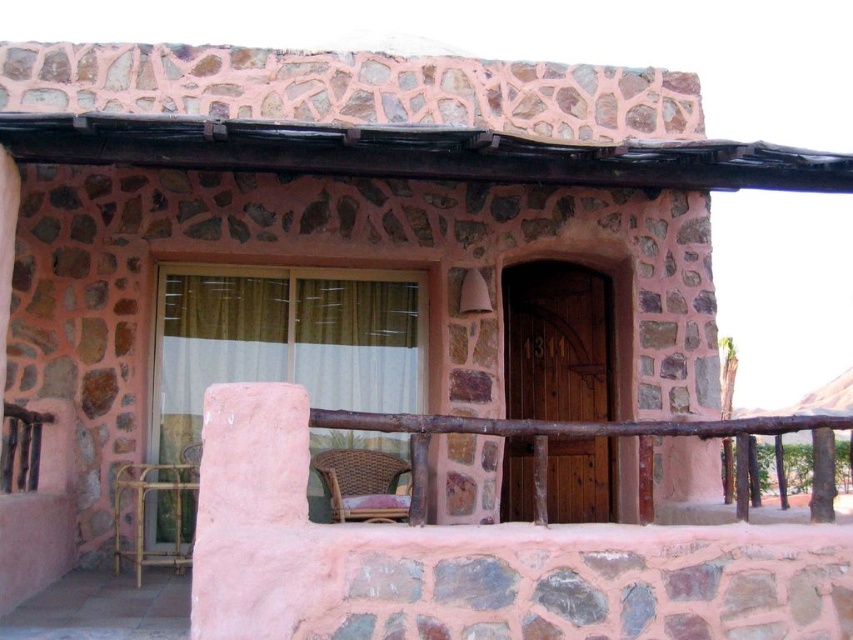
You are a delivery person with a package that measures 1.5 meters in length. You need to navigate between the rattan chair at lower center and the gold bamboo balustrade at lower left to reach the front door. Can your package fit through the space between them?

The distance between the rattan chair at lower center and the gold bamboo balustrade at lower left is 1.44 meters. Since the package is 1.5 meters long, it is slightly too wide to fit through the space. You will need to find an alternative route or reposition the objects to create more space.

You are sitting on the gold bamboo balustrade at lower left and want to move to the rattan chair at lower center. Which direction should you move to reach it?

You should move to the right to reach the rattan chair at lower center since it is positioned on the right side of the gold bamboo balustrade at lower left.

You are trying to move a rectangular table that is 1.2 meters wide through the space between the rattan chair at lower center and the gold bamboo balustrade at lower left. Based on the scene description, can the table fit through that space?

The rattan chair at lower center might be wider than gold bamboo balustrade at lower left, so the space between them may not be wide enough for the table that is 1.2 meters wide. It is uncertain and requires further measurement.